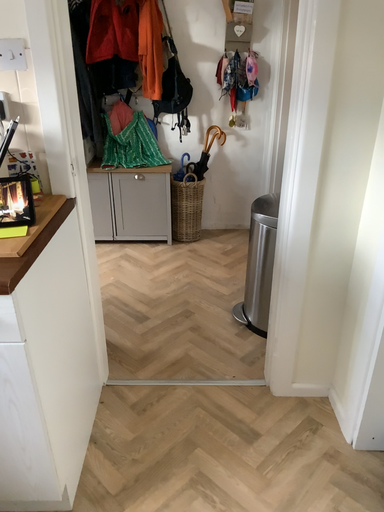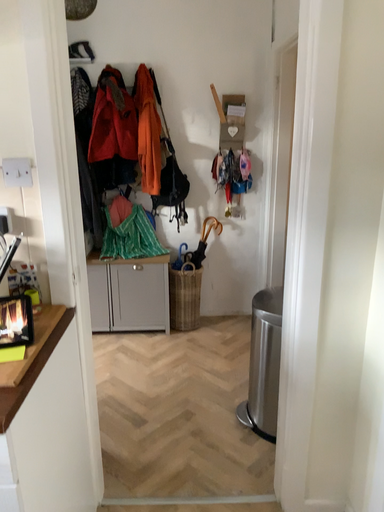
Question: Which way did the camera rotate in the video?

Choices:
 (A) rotated downward
 (B) rotated upward

Answer: (B)